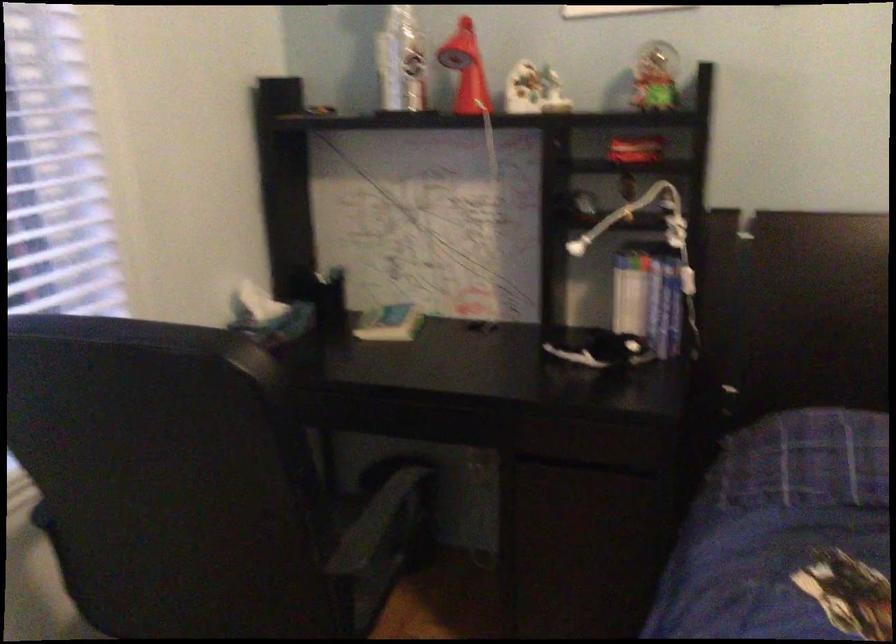
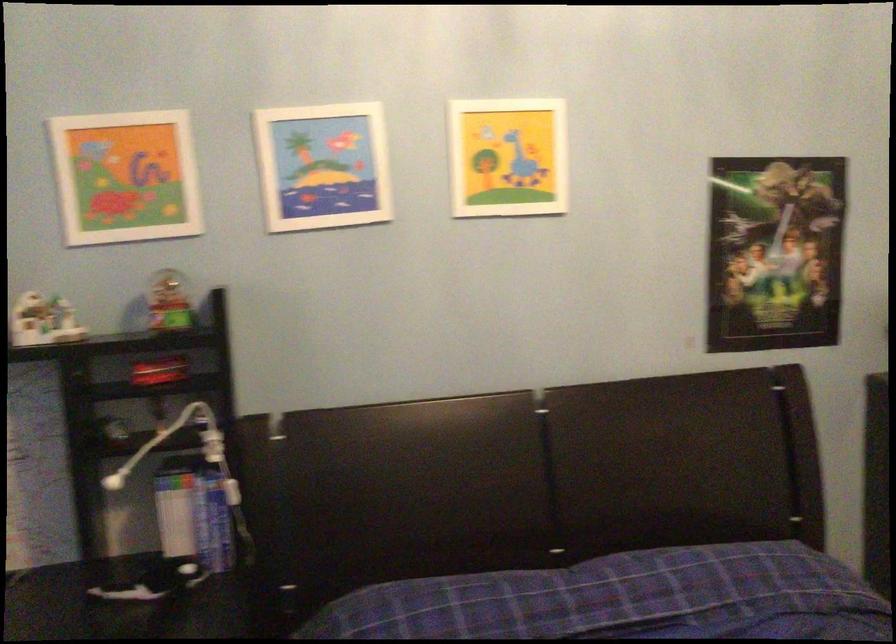
Question: The camera is either moving clockwise (left) or counter-clockwise (right) around the object. The first image is from the beginning of the video and the second image is from the end. Is the camera moving left or right when shooting the video?

Choices:
 (A) Left
 (B) Right

Answer: (A)